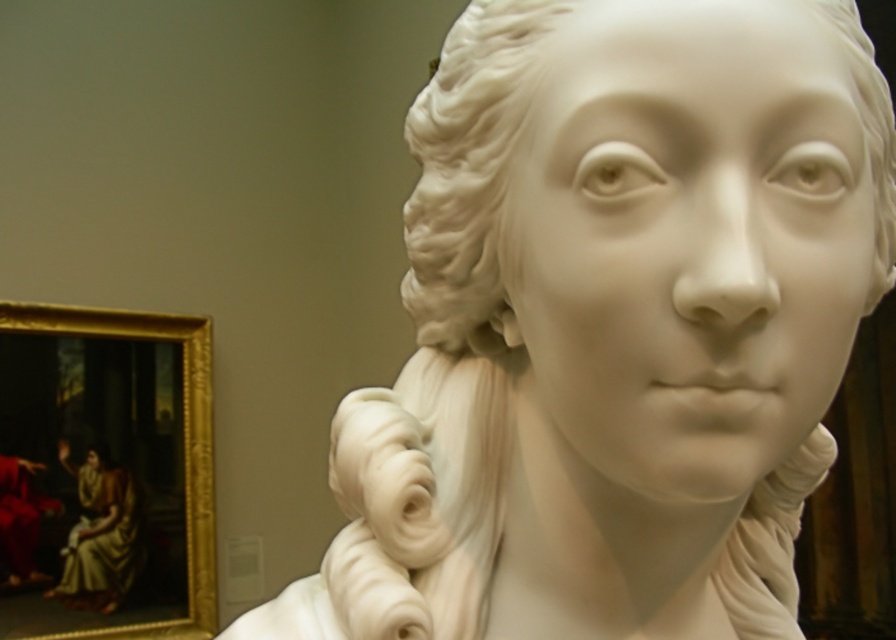
Question: Can you confirm if matte gold fabric at left is positioned to the left of white marble bust at upper left?

Choices:
 (A) no
 (B) yes

Answer: (A)

Question: Does white marble bust at center appear on the right side of white marble bust at upper left?

Choices:
 (A) no
 (B) yes

Answer: (B)

Question: Which of the following is the farthest from the observer?

Choices:
 (A) white marble bust at upper left
 (B) matte gold fabric at left

Answer: (A)

Question: Is white marble bust at center wider than matte gold fabric at left?

Choices:
 (A) no
 (B) yes

Answer: (B)

Question: Which of these objects is positioned farthest from the white marble bust at upper left?

Choices:
 (A) white marble bust at center
 (B) matte gold fabric at left

Answer: (A)

Question: Which point is closer to the camera?

Choices:
 (A) (101, 461)
 (B) (114, 541)

Answer: (A)